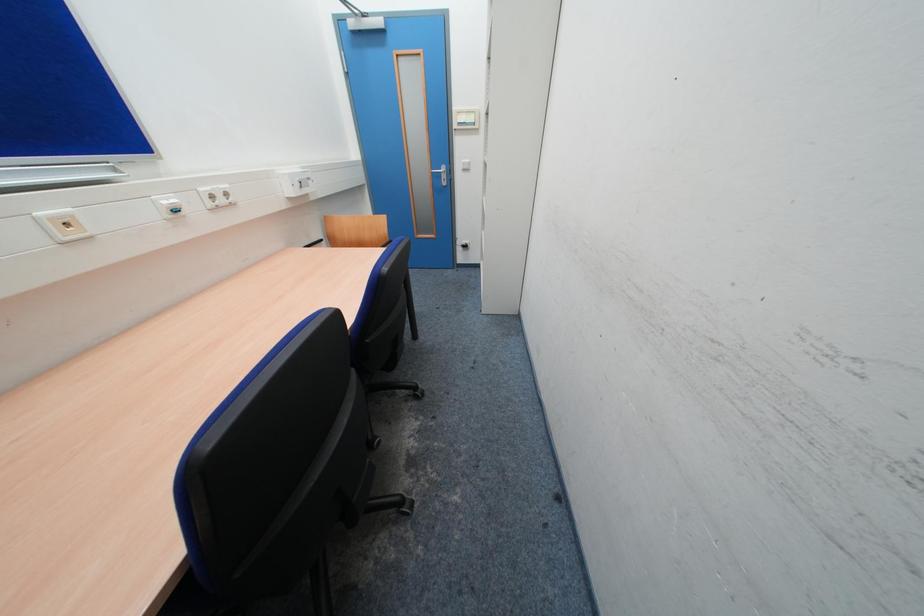
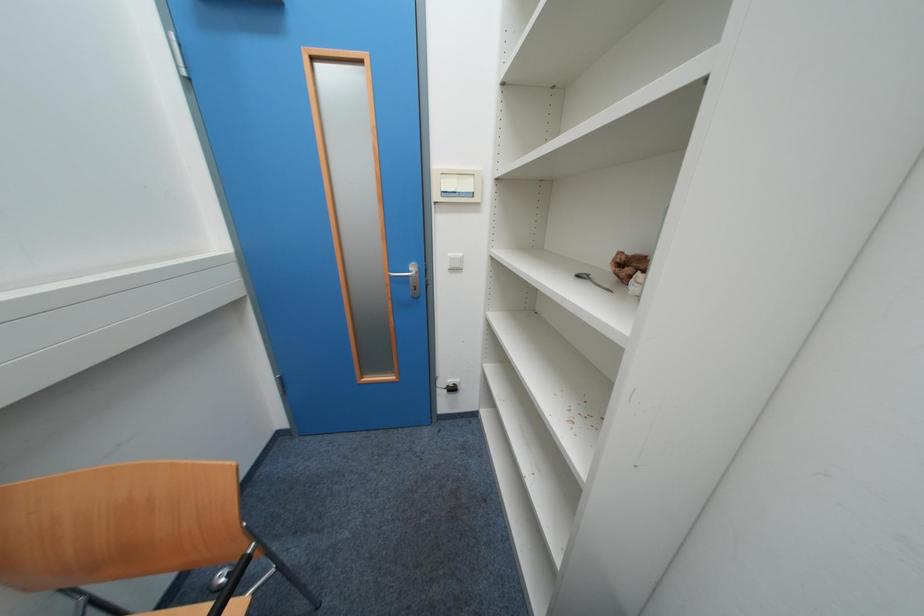
Question: In a continuous first-person perspective shot, in which direction is the camera moving?

Choices:
 (A) Left
 (B) Right
 (C) Forward
 (D) Backward

Answer: (C)